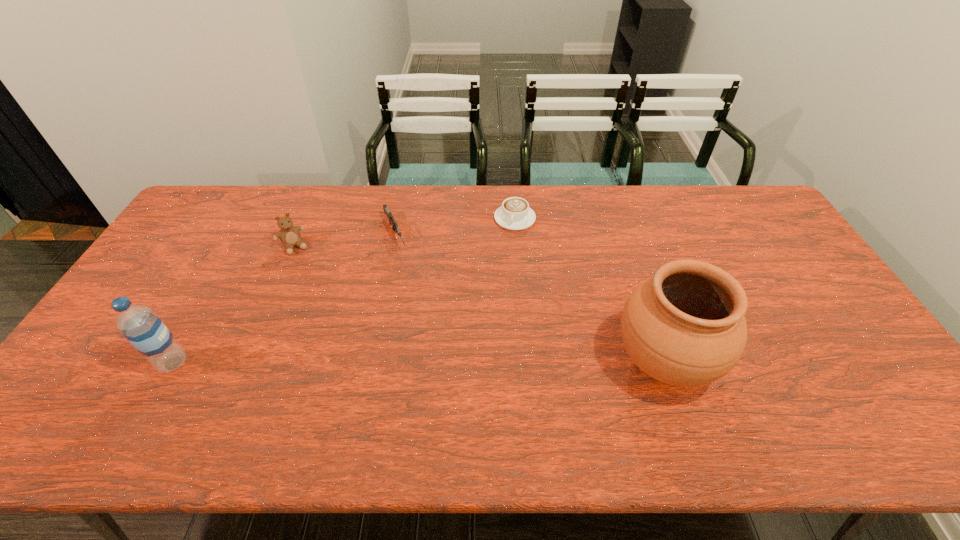
Where is `vacant space on the desktop that is between the water bottle and the rightmost object and is positioned with the handle on the right side of the second object from right to left`? vacant space on the desktop that is between the water bottle and the rightmost object and is positioned with the handle on the right side of the second object from right to left is located at coordinates (491, 362).

In order to click on vacant space on the desktop that is between the water bottle and the pottery and is positioned on the front-facing side of the third shortest object in this screenshot , I will do `click(361, 362)`.

Where is `free space on the desktop that is between the leftmost object and the pottery and is positioned aimed along the barrel of the third object from right to left`? This screenshot has height=540, width=960. free space on the desktop that is between the leftmost object and the pottery and is positioned aimed along the barrel of the third object from right to left is located at coordinates (463, 362).